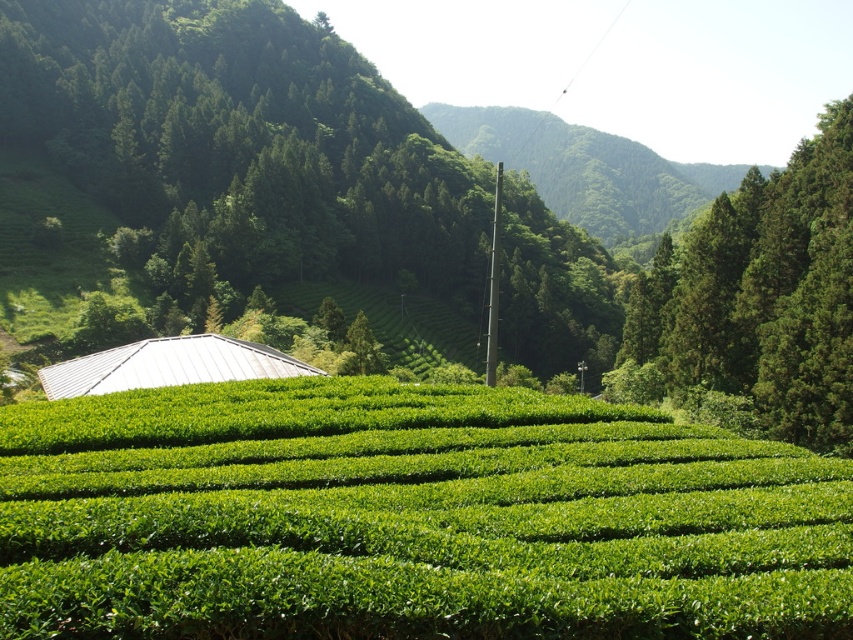
Is green leafy hedge at center further to the viewer compared to green leafy tree at upper right?

No, it is in front of green leafy tree at upper right.

Describe the element at coordinates (409, 518) in the screenshot. The image size is (853, 640). I see `green leafy hedge at center` at that location.

I want to click on green leafy hedge at center, so 409,518.

Can you confirm if green leafy hedge at center is bigger than green leafy tree at center?

Actually, green leafy hedge at center might be smaller than green leafy tree at center.

Where is `green leafy hedge at center`? green leafy hedge at center is located at coordinates (409, 518).

I want to click on green leafy hedge at center, so click(409, 518).

Which is more to the right, green leafy tree at center or green leafy tree at upper right?

Positioned to the right is green leafy tree at upper right.

Which is behind, point (207, 28) or point (830, 228)?

The point (207, 28) is behind.

The width and height of the screenshot is (853, 640). In order to click on green leafy tree at center in this screenshot , I will do `click(242, 145)`.